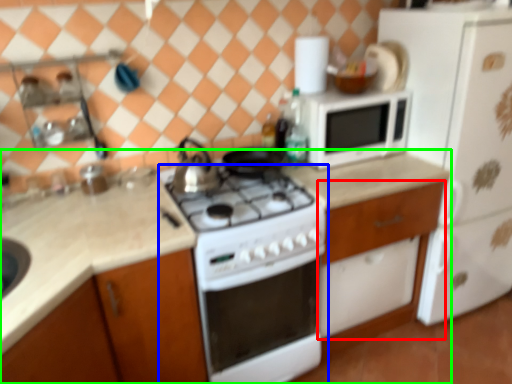
Question: Which object is the farthest from cabinetry (highlighted by a red box)? Choose among these: home appliance (highlighted by a blue box) or countertop (highlighted by a green box).

Choices:
 (A) home appliance
 (B) countertop

Answer: (B)